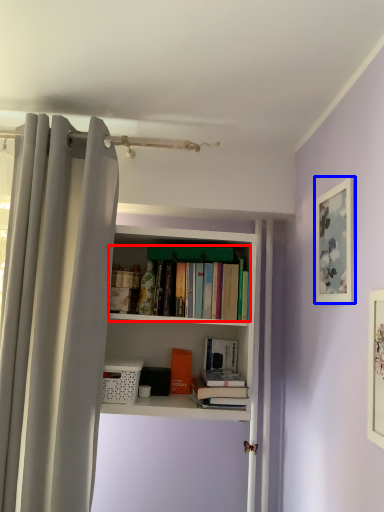
Question: Among these objects, which one is farthest to the camera, book (highlighted by a red box) or picture frame (highlighted by a blue box)?

Choices:
 (A) book
 (B) picture frame

Answer: (A)